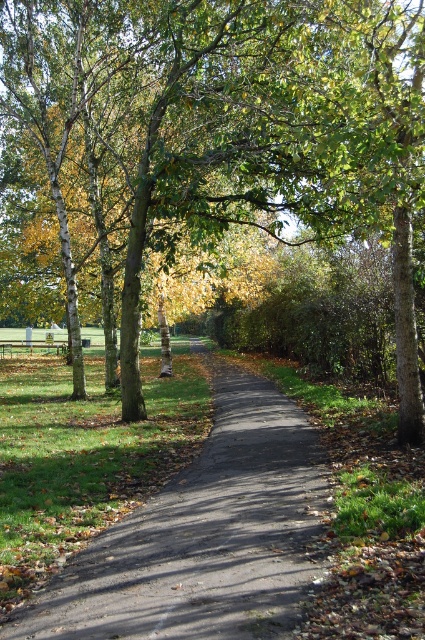
Between brown smooth tree at center and black asphalt path at center, which one appears on the right side from the viewer's perspective?

From the viewer's perspective, black asphalt path at center appears more on the right side.

Does brown smooth tree at center appear under black asphalt path at center?

Actually, brown smooth tree at center is above black asphalt path at center.

Between point (130, 253) and point (286, 440), which one is positioned behind?

Positioned behind is point (130, 253).

You are a GUI agent. You are given a task and a screenshot of the screen. Output one action in this format:
    pyautogui.click(x=<x>, y=<y>)
    Task: Click on the brown smooth tree at center
    
    Given the screenshot: What is the action you would take?
    pyautogui.click(x=226, y=129)

Measure the distance between brown smooth tree at center and camera.

6.88 meters

Can you confirm if brown smooth tree at center is wider than wooden park bench at center?

Yes, brown smooth tree at center is wider than wooden park bench at center.

This screenshot has height=640, width=425. I want to click on brown smooth tree at center, so click(x=226, y=129).

The width and height of the screenshot is (425, 640). I want to click on brown smooth tree at center, so click(226, 129).

Consider the image. Which is above, black asphalt path at center or wooden park bench at center?

Positioned higher is wooden park bench at center.

Does black asphalt path at center come in front of wooden park bench at center?

Yes, black asphalt path at center is in front of wooden park bench at center.

Where is `black asphalt path at center`? black asphalt path at center is located at coordinates (204, 536).